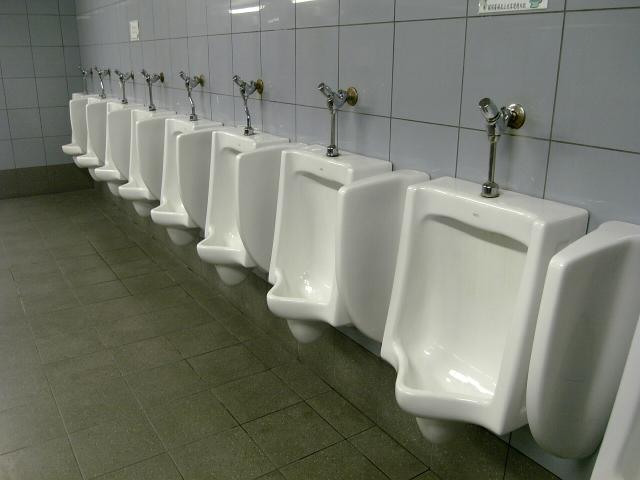
The image size is (640, 480). In order to click on urinals in this screenshot , I will do `click(486, 290)`, `click(303, 232)`, `click(223, 210)`, `click(164, 203)`, `click(131, 191)`, `click(105, 173)`, `click(86, 158)`, `click(70, 149)`.